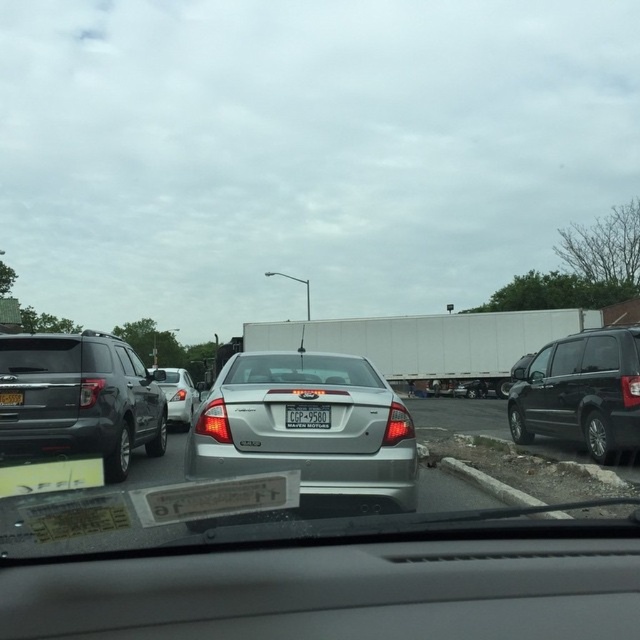
You are sitting in the driver seat of the vehicle shown in the scene. You see two points marked on the windshield wipers at the bottom of the frame. The first point is at coordinate point [323,440] and the second point is at coordinate point [4,400]. Which point is closer to you?

Point [323,440] is closer to the viewer than point [4,400].

You are driving a car and see a point marked at coordinates (580, 392) on your navigation system. Based on the scene description, what vehicle is located at that point?

The point at coordinates (580, 392) indicates a shiny black minivan at right.